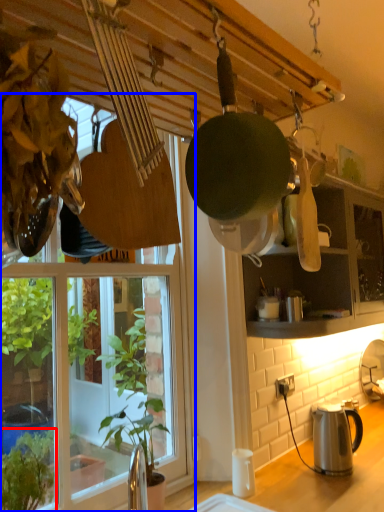
Question: Which object appears farthest to the camera in this image, houseplant (highlighted by a red box) or window (highlighted by a blue box)?

Choices:
 (A) houseplant
 (B) window

Answer: (A)